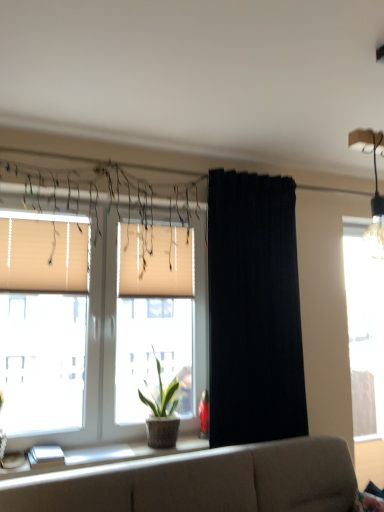
The width and height of the screenshot is (384, 512). I want to click on vacant area situated to the left side of green leafy plant in woven pot at window, so click(x=116, y=449).